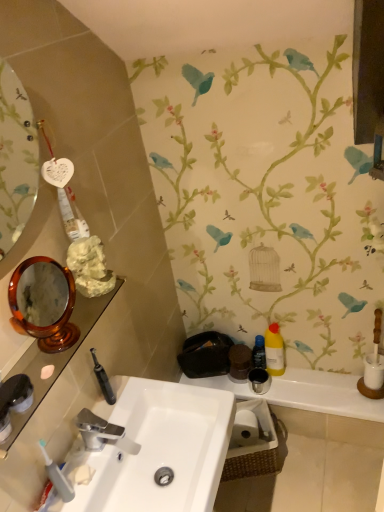
Question: From a real-world perspective, is translucent plastic toothbrush at lower left under white matte toilet paper at lower center?

Choices:
 (A) no
 (B) yes

Answer: (A)

Question: From the image's perspective, does translucent plastic toothbrush at lower left appear lower than white matte toilet paper at lower center?

Choices:
 (A) no
 (B) yes

Answer: (A)

Question: Can you confirm if translucent plastic toothbrush at lower left is bigger than white matte toilet paper at lower center?

Choices:
 (A) no
 (B) yes

Answer: (A)

Question: Is translucent plastic toothbrush at lower left taller than white matte toilet paper at lower center?

Choices:
 (A) no
 (B) yes

Answer: (B)

Question: Considering the relative positions of translucent plastic toothbrush at lower left and white matte toilet paper at lower center in the image provided, is translucent plastic toothbrush at lower left behind white matte toilet paper at lower center?

Choices:
 (A) yes
 (B) no

Answer: (B)

Question: From the image's perspective, is silver metallic faucet at center positioned above or below yellow matte bottle at right, placed as the 2th mouthwash when sorted from left to right?

Choices:
 (A) below
 (B) above

Answer: (A)

Question: In terms of size, does silver metallic faucet at center appear bigger or smaller than yellow matte bottle at right, placed as the 2th mouthwash when sorted from left to right?

Choices:
 (A) big
 (B) small

Answer: (B)

Question: Is silver metallic faucet at center situated inside yellow matte bottle at right, the 1th mouthwash viewed from the right, or outside?

Choices:
 (A) inside
 (B) outside

Answer: (B)

Question: Relative to yellow matte bottle at right, the 1th mouthwash viewed from the right, is silver metallic faucet at center in front or behind?

Choices:
 (A) front
 (B) behind

Answer: (A)

Question: Is white glossy sink at center situated inside yellow matte bottle at right, the 1th mouthwash viewed from the right, or outside?

Choices:
 (A) inside
 (B) outside

Answer: (B)

Question: Considering the positions of point (125, 494) and point (276, 365), is point (125, 494) closer or farther from the camera than point (276, 365)?

Choices:
 (A) farther
 (B) closer

Answer: (B)

Question: Looking at their shapes, would you say white glossy sink at center is wider or thinner than yellow matte bottle at right, placed as the 2th mouthwash when sorted from left to right?

Choices:
 (A) thin
 (B) wide

Answer: (B)

Question: Is white glossy sink at center in front of or behind yellow matte bottle at right, placed as the 2th mouthwash when sorted from left to right, in the image?

Choices:
 (A) front
 (B) behind

Answer: (A)

Question: In terms of size, does matte black tray at lower center appear bigger or smaller than silver metallic faucet at center?

Choices:
 (A) small
 (B) big

Answer: (B)

Question: In terms of width, does matte black tray at lower center look wider or thinner when compared to silver metallic faucet at center?

Choices:
 (A) thin
 (B) wide

Answer: (B)